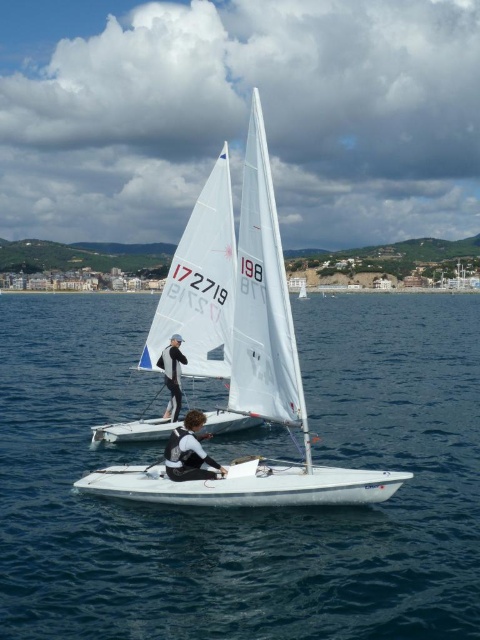
Question: Where is white glossy sailboat at center located in relation to white matte sailboat at center in the image?

Choices:
 (A) above
 (B) below

Answer: (B)

Question: Considering the real-world distances, which object is farthest from the white matte sailboat at center?

Choices:
 (A) black wetsuit at center
 (B) white glossy sailboat at center
 (C) black neoprene wetsuit at center

Answer: (B)

Question: Which object is positioned farthest from the black neoprene wetsuit at center?

Choices:
 (A) white glossy sailboat at center
 (B) black wetsuit at center
 (C) white smooth water at center

Answer: (C)

Question: Which point is closer to the camera taking this photo?

Choices:
 (A) (166, 356)
 (B) (28, 321)

Answer: (A)

Question: Does white glossy sailboat at center come in front of black wetsuit at center?

Choices:
 (A) no
 (B) yes

Answer: (B)

Question: Can you confirm if white smooth water at center is positioned to the left of white matte sailboat at center?

Choices:
 (A) yes
 (B) no

Answer: (A)